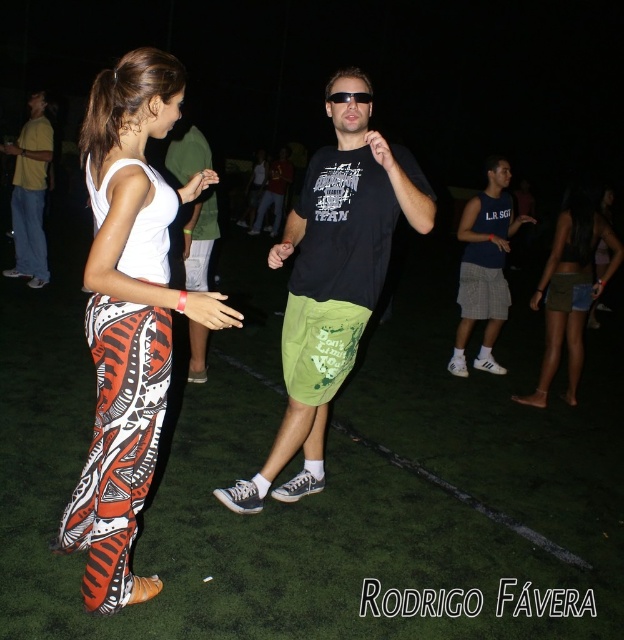
Question: Which of these objects is positioned closest to the blue jersey at center?

Choices:
 (A) denim shorts at lower right
 (B) green artificial turf at center

Answer: (A)

Question: Which of the following is the farthest from the observer?

Choices:
 (A) green fabric shorts at center
 (B) yellow cotton shirt at left
 (C) denim shorts at lower right

Answer: (B)

Question: Does denim shorts at lower right appear over green fabric shorts at center?

Choices:
 (A) no
 (B) yes

Answer: (A)

Question: Does green artificial turf at center appear on the left side of black matte t-shirt at center?

Choices:
 (A) no
 (B) yes

Answer: (A)

Question: Which object is positioned closest to the green fabric shorts at center?

Choices:
 (A) blue jersey at center
 (B) green artificial turf at center
 (C) yellow cotton shirt at left

Answer: (B)

Question: Is the position of green artificial turf at center less distant than that of blue jersey at center?

Choices:
 (A) no
 (B) yes

Answer: (B)